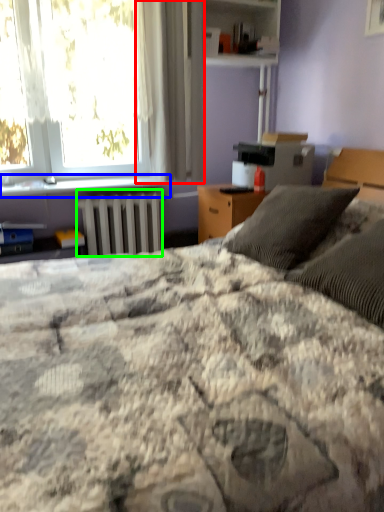
Question: Which object is positioned farthest from curtain (highlighted by a red box)? Select from window sill (highlighted by a blue box) and radiator (highlighted by a green box).

Choices:
 (A) window sill
 (B) radiator

Answer: (A)